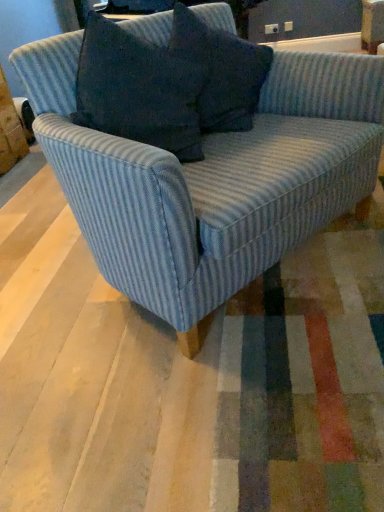
Question: Is blue striped fabric couch at center inside or outside of blue textured pillow at upper center?

Choices:
 (A) inside
 (B) outside

Answer: (B)

Question: From a real-world perspective, is blue striped fabric couch at center physically located above or below blue textured pillow at upper center?

Choices:
 (A) below
 (B) above

Answer: (A)

Question: Is point (148, 28) closer or farther from the camera than point (215, 56)?

Choices:
 (A) farther
 (B) closer

Answer: (B)

Question: From the image's perspective, is blue textured pillow at upper center positioned above or below blue striped fabric couch at center?

Choices:
 (A) below
 (B) above

Answer: (B)

Question: From a real-world perspective, is blue textured pillow at upper center positioned above or below blue striped fabric couch at center?

Choices:
 (A) below
 (B) above

Answer: (B)

Question: Is blue textured pillow at upper center wider or thinner than blue striped fabric couch at center?

Choices:
 (A) wide
 (B) thin

Answer: (B)

Question: Looking at the image, does blue textured pillow at upper center seem bigger or smaller compared to blue striped fabric couch at center?

Choices:
 (A) big
 (B) small

Answer: (B)